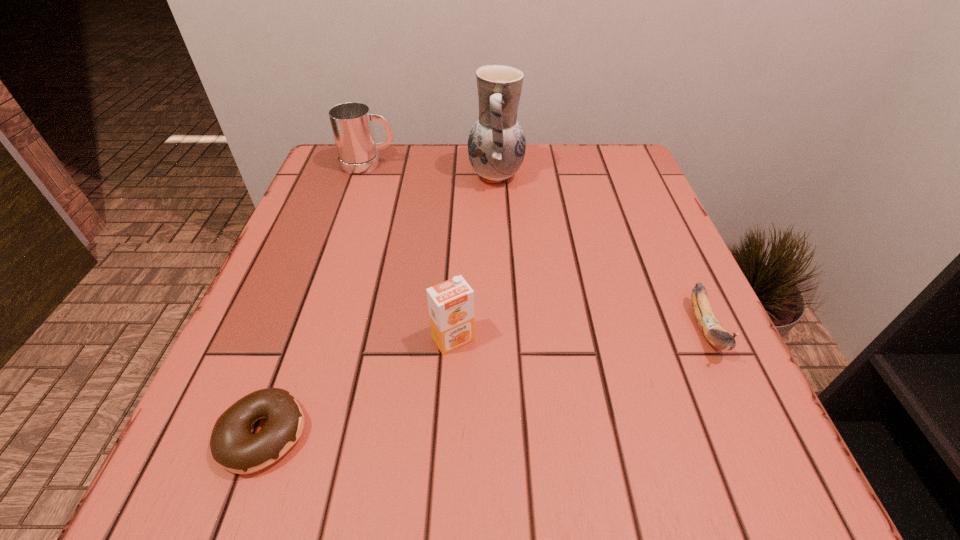
At what (x,y) coordinates should I click in order to perform the action: click on vacant point that satisfies the following two spatial constraints: 1. on the side of the orange juice with the handle; 2. on the left side of the mug. Please return your answer as a coordinate pair (x, y). This screenshot has height=540, width=960. Looking at the image, I should click on [310, 339].